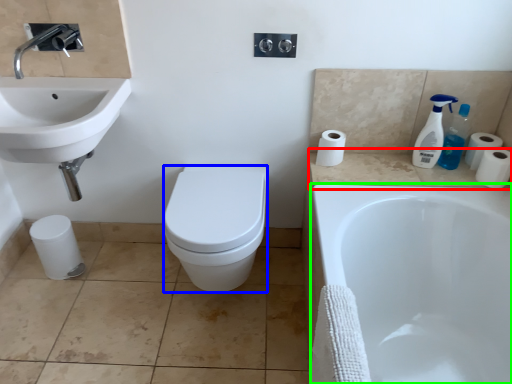
Question: Which object is the farthest from counter top (highlighted by a red box)? Choose among these: bidet (highlighted by a blue box) or bathtub (highlighted by a green box).

Choices:
 (A) bidet
 (B) bathtub

Answer: (A)